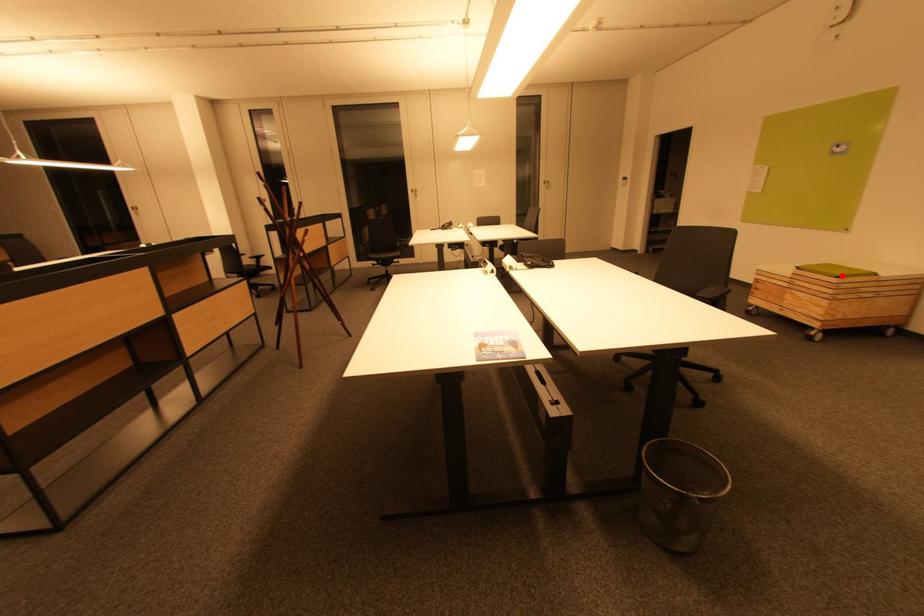
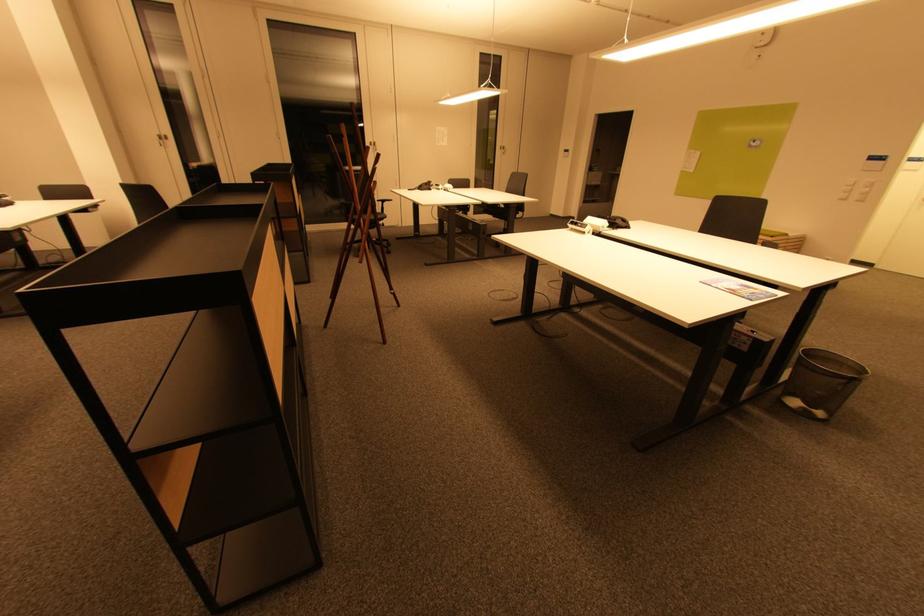
Locate, in the second image, the point that corresponds to the highlighted location in the first image.

(775, 236)